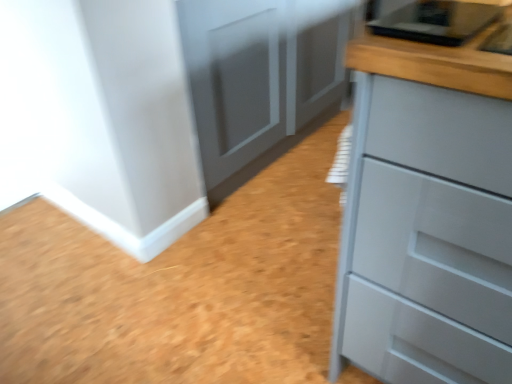
Question: From a real-world perspective, is matte gray cupboard at center over matte gray chest of drawers at right?

Choices:
 (A) yes
 (B) no

Answer: (B)

Question: Does matte gray cupboard at center have a greater height compared to matte gray chest of drawers at right?

Choices:
 (A) no
 (B) yes

Answer: (A)

Question: From a real-world perspective, is matte gray cupboard at center beneath matte gray chest of drawers at right?

Choices:
 (A) no
 (B) yes

Answer: (B)

Question: Is matte gray cupboard at center oriented towards matte gray chest of drawers at right?

Choices:
 (A) yes
 (B) no

Answer: (A)

Question: Considering the relative positions of matte gray cupboard at center and matte gray chest of drawers at right in the image provided, is matte gray cupboard at center to the left of matte gray chest of drawers at right from the viewer's perspective?

Choices:
 (A) yes
 (B) no

Answer: (A)

Question: Does matte gray cupboard at center have a lesser height compared to matte gray chest of drawers at right?

Choices:
 (A) yes
 (B) no

Answer: (A)

Question: Considering the relative sizes of matte gray chest of drawers at right and matte gray cupboard at center in the image provided, is matte gray chest of drawers at right shorter than matte gray cupboard at center?

Choices:
 (A) no
 (B) yes

Answer: (A)

Question: Does matte gray chest of drawers at right have a greater height compared to matte gray cupboard at center?

Choices:
 (A) no
 (B) yes

Answer: (B)

Question: Is matte gray chest of drawers at right further to the viewer compared to matte gray cupboard at center?

Choices:
 (A) yes
 (B) no

Answer: (B)

Question: Does matte gray chest of drawers at right have a larger size compared to matte gray cupboard at center?

Choices:
 (A) no
 (B) yes

Answer: (A)

Question: Can you see matte gray chest of drawers at right touching matte gray cupboard at center?

Choices:
 (A) no
 (B) yes

Answer: (A)

Question: From a real-world perspective, is matte gray chest of drawers at right under matte gray cupboard at center?

Choices:
 (A) no
 (B) yes

Answer: (A)

Question: Do you think matte gray chest of drawers at right is within matte gray cupboard at center, or outside of it?

Choices:
 (A) outside
 (B) inside

Answer: (A)